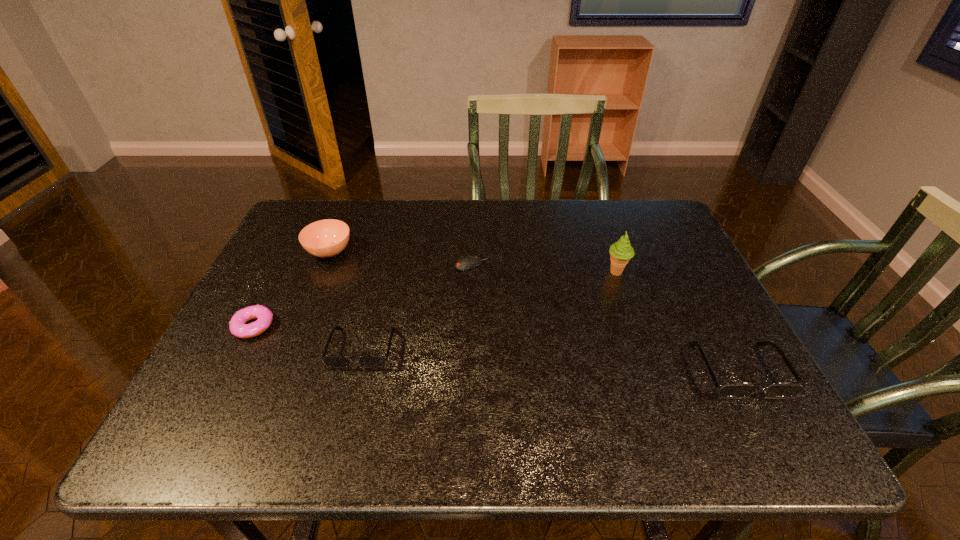
Where is `the left sunglasses`? the left sunglasses is located at coordinates (330, 361).

At what (x,y) coordinates should I click in order to perform the action: click on the third object from left to right. Please return your answer as a coordinate pair (x, y). This screenshot has height=540, width=960. Looking at the image, I should click on (330, 361).

Identify the location of the rightmost object. The image size is (960, 540). (730, 389).

Identify the location of the taller sunglasses. The width and height of the screenshot is (960, 540). (730, 389).

Image resolution: width=960 pixels, height=540 pixels. Find the location of `soup bowl`. soup bowl is located at coordinates (326, 238).

Where is `the third object from right to left`? The image size is (960, 540). the third object from right to left is located at coordinates (467, 262).

Where is `computer mouse`? Image resolution: width=960 pixels, height=540 pixels. computer mouse is located at coordinates pos(467,262).

Find the location of `the second object from right to left`. the second object from right to left is located at coordinates (621, 252).

The height and width of the screenshot is (540, 960). Identify the location of icecream. (621, 252).

Locate an element on the screen. doughnut is located at coordinates (237, 325).